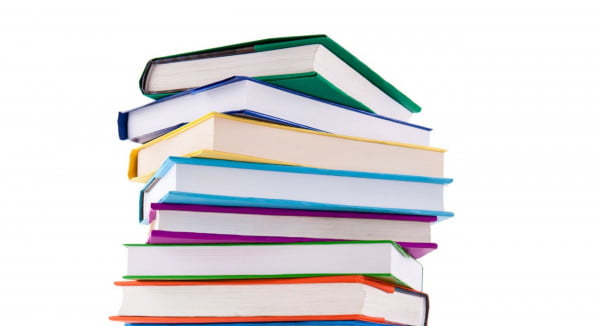
Image resolution: width=600 pixels, height=326 pixels. Find the location of `books`. books is located at coordinates (319, 325), (310, 293), (304, 256), (286, 224), (274, 191), (270, 142), (262, 103), (268, 60).